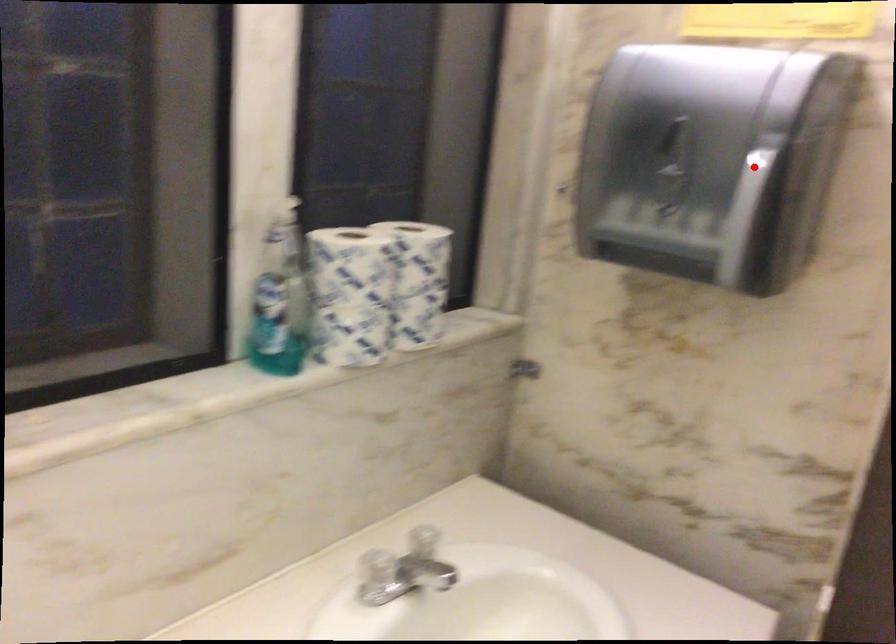
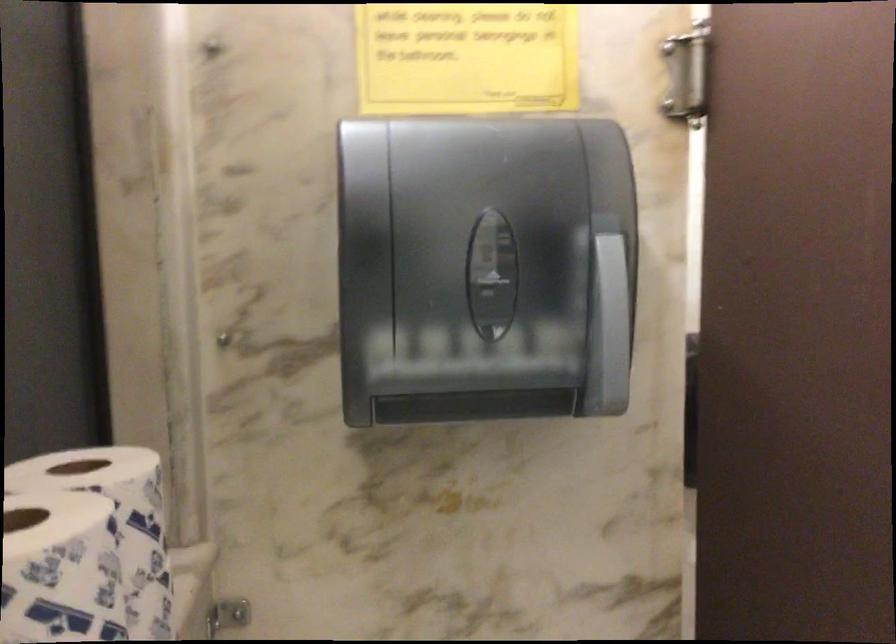
The point at the highlighted location is marked in the first image. Where is the corresponding point in the second image?

(612, 251)